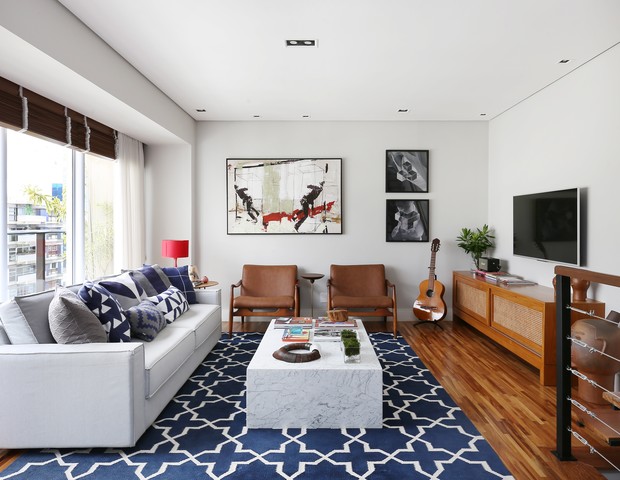
The image size is (620, 480). I want to click on pillows, so click(x=124, y=299).